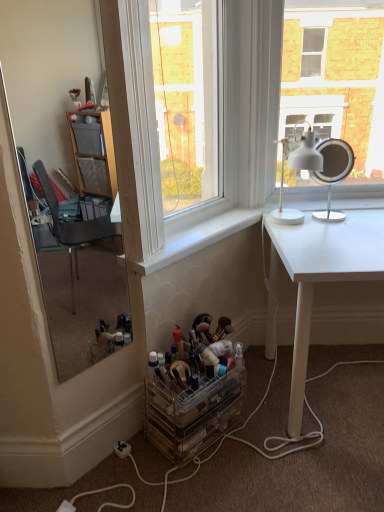
This screenshot has height=512, width=384. I want to click on vacant space in white matte table lamp at upper right, the 1th table lamp positioned from the left (from a real-world perspective), so click(289, 221).